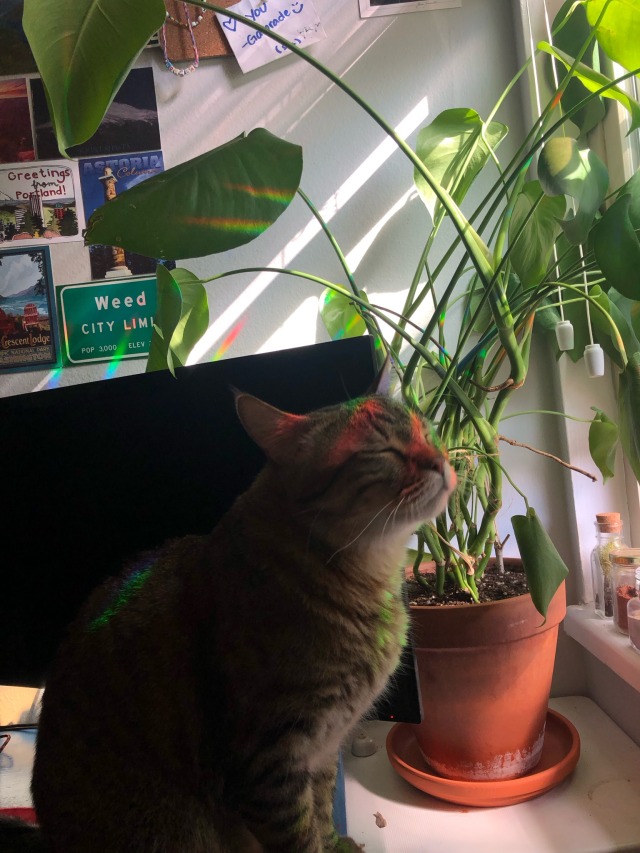
Find the location of a particular element. chest is located at coordinates (374, 643).